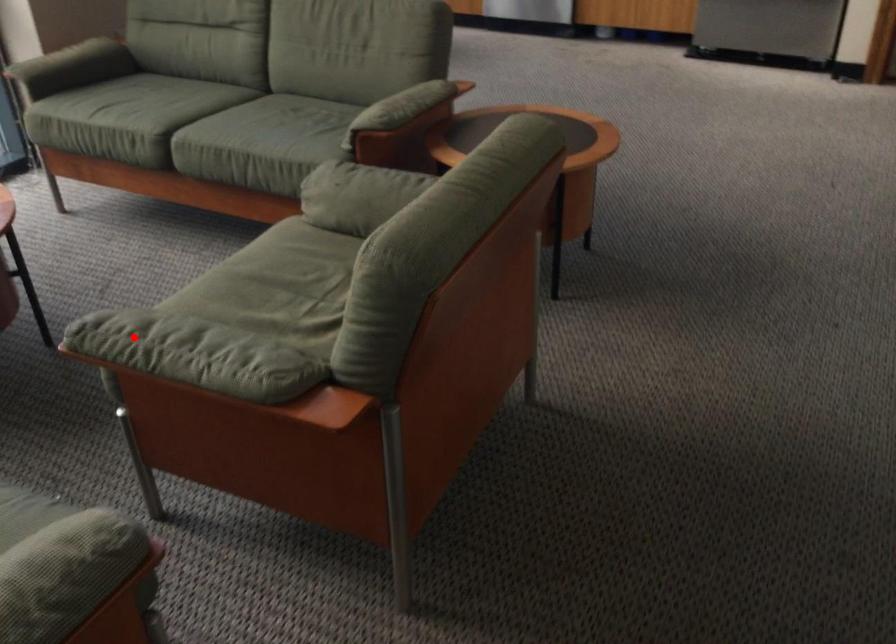
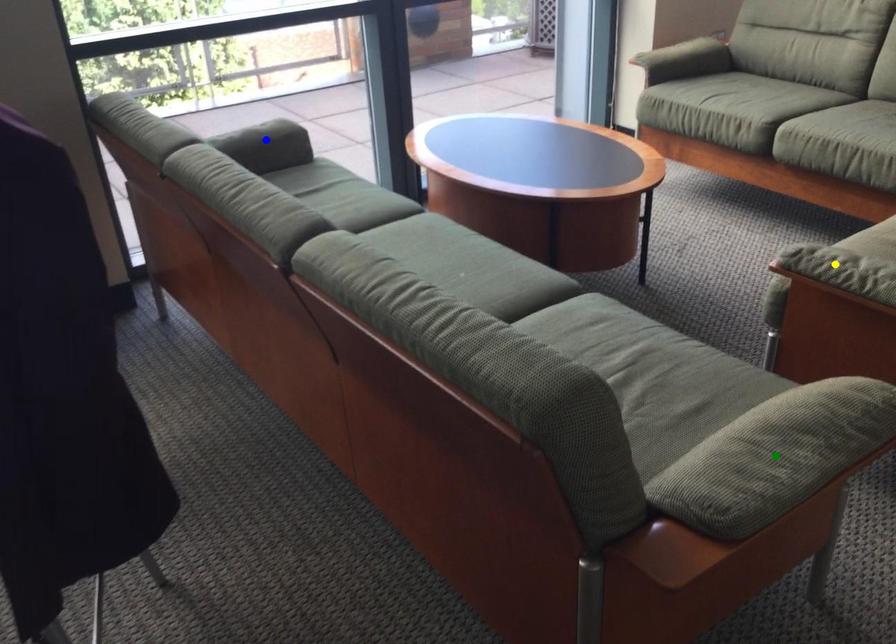
Question: I am providing you with two images of the same scene from different viewpoints. A red point is marked on the first image. You are given multiple points on the second image. In image 2, which mark is for the same physical point as the one in image 1?

Choices:
 (A) green point
 (B) blue point
 (C) yellow point

Answer: (C)